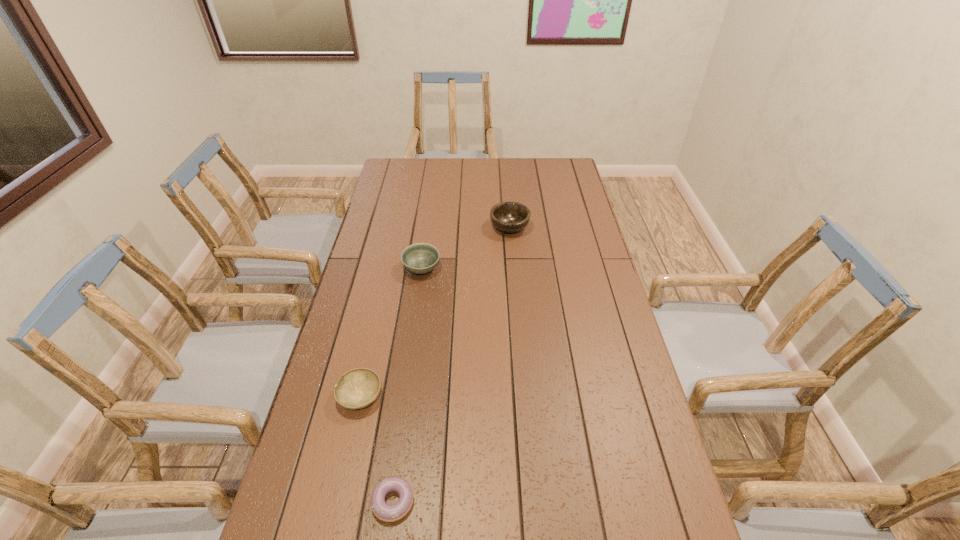
Identify the location of vacant area between the shortest bowl and the rightmost object. (435, 312).

Where is `empty space between the farthest bowl and the second farthest bowl`? This screenshot has height=540, width=960. empty space between the farthest bowl and the second farthest bowl is located at coordinates (466, 248).

Find the location of a particular element. Image resolution: width=960 pixels, height=540 pixels. free spot between the third nearest object and the farthest object is located at coordinates (466, 248).

Find the location of a particular element. The height and width of the screenshot is (540, 960). blank region between the doughnut and the farthest object is located at coordinates (451, 364).

This screenshot has height=540, width=960. I want to click on vacant area that lies between the nearest object and the rightmost object, so click(451, 364).

Where is `vacant area that lies between the rightmost bowl and the third nearest object`? vacant area that lies between the rightmost bowl and the third nearest object is located at coordinates (466, 248).

In order to click on object that is the closest to the nearest bowl in this screenshot , I will do pos(389,513).

Identify which object is located as the nearest to the second nearest bowl. Please provide its 2D coordinates. Your answer should be formatted as a tuple, i.e. [(x, y)], where the tuple contains the x and y coordinates of a point satisfying the conditions above.

[(510, 217)]

Locate which bowl ranks third in proximity to the nearest object. Please provide its 2D coordinates. Your answer should be formatted as a tuple, i.e. [(x, y)], where the tuple contains the x and y coordinates of a point satisfying the conditions above.

[(510, 217)]

Identify which bowl is the closest to the farthest object. Please provide its 2D coordinates. Your answer should be formatted as a tuple, i.e. [(x, y)], where the tuple contains the x and y coordinates of a point satisfying the conditions above.

[(420, 258)]